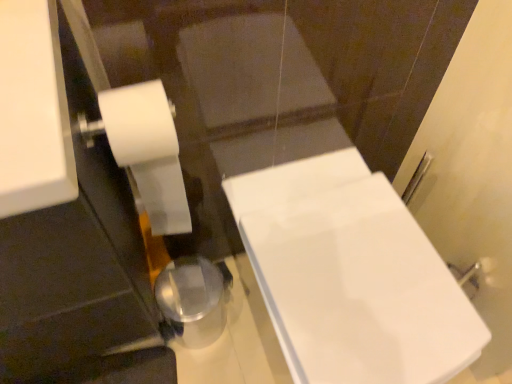
What is the approximate height of white matte toilet paper at left?

white matte toilet paper at left is 46.84 centimeters in height.

The height and width of the screenshot is (384, 512). What do you see at coordinates (148, 151) in the screenshot?
I see `white matte toilet paper at left` at bounding box center [148, 151].

This screenshot has height=384, width=512. Identify the location of white matte toilet paper at left. (148, 151).

Locate an element on the screen. The height and width of the screenshot is (384, 512). white glossy bathtub at center is located at coordinates (350, 276).

Describe the element at coordinates (350, 276) in the screenshot. I see `white glossy bathtub at center` at that location.

The height and width of the screenshot is (384, 512). I want to click on white matte toilet paper at left, so click(148, 151).

Between white matte toilet paper at left and white glossy bathtub at center, which one appears on the left side from the viewer's perspective?

white matte toilet paper at left.

Is white matte toilet paper at left further to camera compared to white glossy bathtub at center?

No, white matte toilet paper at left is closer to the camera.

Is point (101, 101) less distant than point (436, 329)?

Yes, it is in front of point (436, 329).

From the image's perspective, is white matte toilet paper at left above or below white glossy bathtub at center?

white matte toilet paper at left is situated higher than white glossy bathtub at center in the image.

From a real-world perspective, who is located higher, white matte toilet paper at left or white glossy bathtub at center?

white matte toilet paper at left is physically above.

Considering the sizes of white matte toilet paper at left and white glossy bathtub at center in the image, is white matte toilet paper at left wider or thinner than white glossy bathtub at center?

white matte toilet paper at left is thinner than white glossy bathtub at center.

Does white matte toilet paper at left have a lesser height compared to white glossy bathtub at center?

Correct, white matte toilet paper at left is not as tall as white glossy bathtub at center.

Based on the photo, considering the relative sizes of white matte toilet paper at left and white glossy bathtub at center in the image provided, is white matte toilet paper at left smaller than white glossy bathtub at center?

Correct, white matte toilet paper at left occupies less space than white glossy bathtub at center.

Is white glossy bathtub at center surrounded by white matte toilet paper at left?

No, white glossy bathtub at center is not inside white matte toilet paper at left.

Can you see white matte toilet paper at left touching white glossy bathtub at center?

No, white matte toilet paper at left is not beside white glossy bathtub at center.

Is white matte toilet paper at left oriented away from white glossy bathtub at center?

No, white glossy bathtub at center is not at the back of white matte toilet paper at left.

What are the coordinates of `toilet paper on the left side of white glossy bathtub at center` in the screenshot? It's located at (148, 151).

Which is more to the right, white glossy bathtub at center or white matte toilet paper at left?

white glossy bathtub at center.

Which object is closer to the camera taking this photo, white glossy bathtub at center or white matte toilet paper at left?

white matte toilet paper at left is closer to the camera.

Between point (395, 252) and point (166, 152), which one is positioned in front?

The point (166, 152) is closer.

From the image's perspective, is white glossy bathtub at center on top of white matte toilet paper at left?

No.

From a real-world perspective, is white glossy bathtub at center physically located above or below white matte toilet paper at left?

white glossy bathtub at center is below white matte toilet paper at left.

Which object is thinner, white glossy bathtub at center or white matte toilet paper at left?

Thinner between the two is white matte toilet paper at left.

Between white glossy bathtub at center and white matte toilet paper at left, which one has less height?

With less height is white matte toilet paper at left.

Does white glossy bathtub at center have a larger size compared to white matte toilet paper at left?

Correct, white glossy bathtub at center is larger in size than white matte toilet paper at left.

In the scene shown: Is white glossy bathtub at center situated inside white matte toilet paper at left or outside?

white glossy bathtub at center lies outside white matte toilet paper at left.

Would you say white glossy bathtub at center is a long distance from white matte toilet paper at left?

No, white glossy bathtub at center is not far away from white matte toilet paper at left.

Is white matte toilet paper at left at the back of white glossy bathtub at center?

white glossy bathtub at center does not have its back to white matte toilet paper at left.

How different are the orientations of white glossy bathtub at center and white matte toilet paper at left in degrees?

The angular difference between white glossy bathtub at center and white matte toilet paper at left is 2.69 degrees.

This screenshot has height=384, width=512. Identify the location of toilet paper located above the white glossy bathtub at center (from the image's perspective). (148, 151).

The image size is (512, 384). Identify the location of toilet paper that is on the left side of white glossy bathtub at center. click(148, 151).

Identify the location of toilet paper above the white glossy bathtub at center (from a real-world perspective). (148, 151).